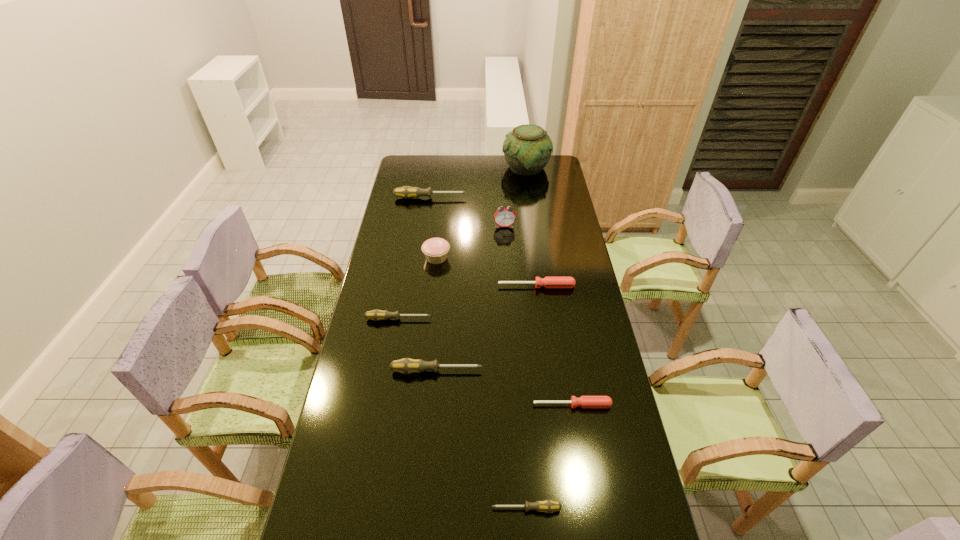
Where is `pottery that is at the right edge`? pottery that is at the right edge is located at coordinates (527, 149).

At what (x,y) coordinates should I click in order to perform the action: click on object situated at the far right corner. Please return your answer as a coordinate pair (x, y). Looking at the image, I should click on (527, 149).

The image size is (960, 540). In the image, there is a desktop. In order to click on vacant region at the far edge in this screenshot , I will do `click(502, 170)`.

Image resolution: width=960 pixels, height=540 pixels. I want to click on free space at the left edge of the desktop, so click(396, 283).

The image size is (960, 540). In the image, there is a desktop. In order to click on vacant space at the right edge in this screenshot , I will do `click(564, 238)`.

The width and height of the screenshot is (960, 540). In the image, there is a desktop. Identify the location of vacant space at the far left corner. (422, 161).

Locate an element on the screen. The width and height of the screenshot is (960, 540). vacant area that lies between the farthest screwdriver and the alarm clock is located at coordinates (468, 212).

Find the location of `free space between the second smallest gray screwdriver and the nearest gray screwdriver`. free space between the second smallest gray screwdriver and the nearest gray screwdriver is located at coordinates (463, 414).

You are a GUI agent. You are given a task and a screenshot of the screen. Output one action in this format:
    pyautogui.click(x=<x>, y=<y>)
    Task: Click on the blank region between the second nearest gray screwdriver and the sixth farthest object
    
    Given the screenshot: What is the action you would take?
    pyautogui.click(x=418, y=345)

The width and height of the screenshot is (960, 540). I want to click on empty location between the nearest gray screwdriver and the eighth farthest object, so click(x=549, y=457).